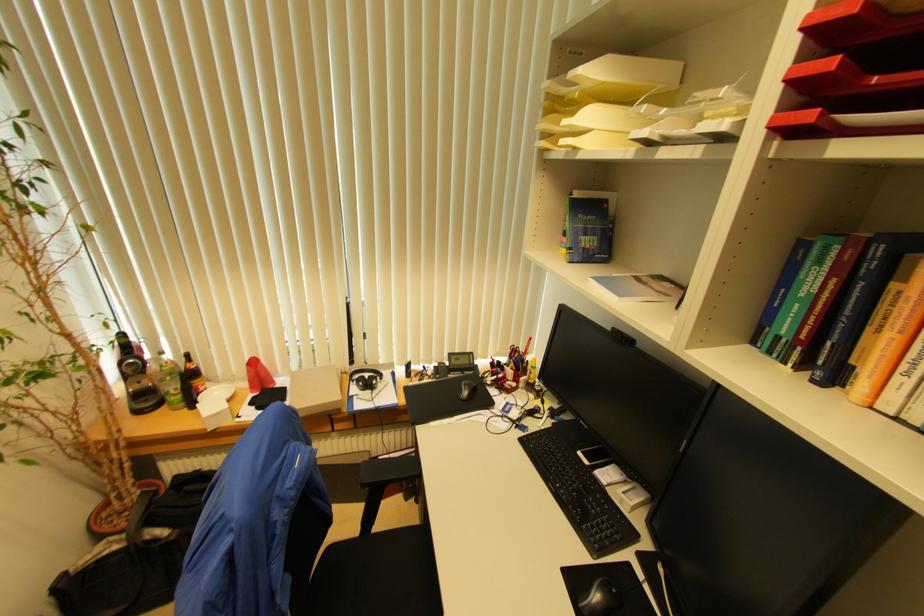
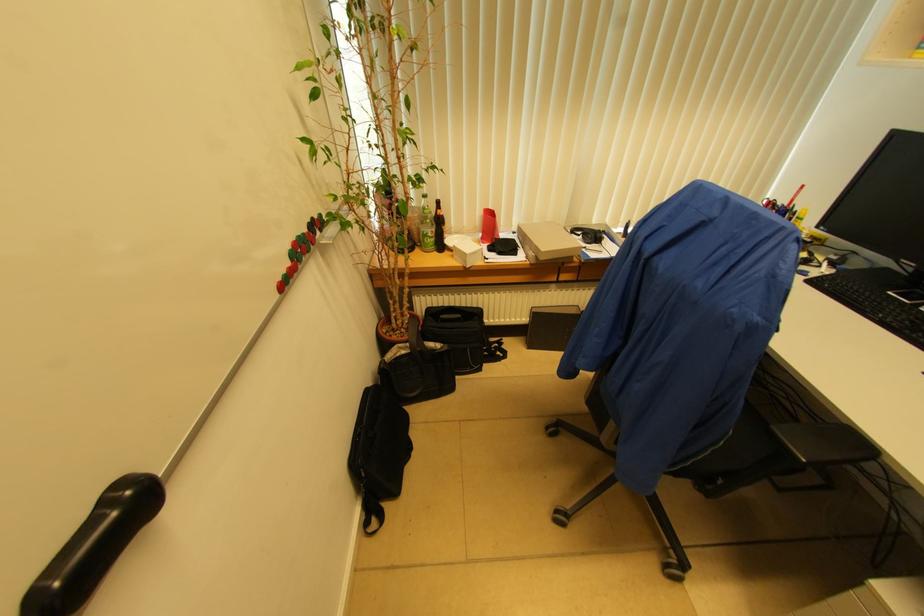
Find the pixel in the second image that matches [529,363] in the first image.

(796, 215)